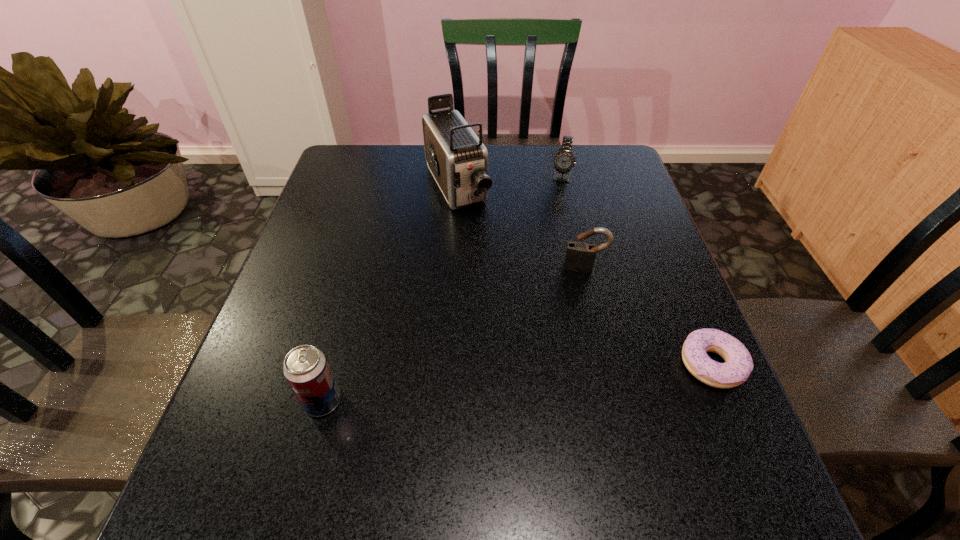
At what (x,y) coordinates should I click in order to perform the action: click on vacant space on the desktop that is between the leftmost object and the rightmost object and is positioned on the face of the watch. Please return your answer as a coordinate pair (x, y). The image size is (960, 540). Looking at the image, I should click on (518, 383).

Identify the location of vacant space on the desktop that is between the leftmost object and the doughnut and is positioned with the keyhole on the front of the third farthest object. (576, 377).

In order to click on free spot on the desktop that is between the leftmost object and the doughnut and is positioned at the lens of the camcorder in this screenshot , I will do coord(571,378).